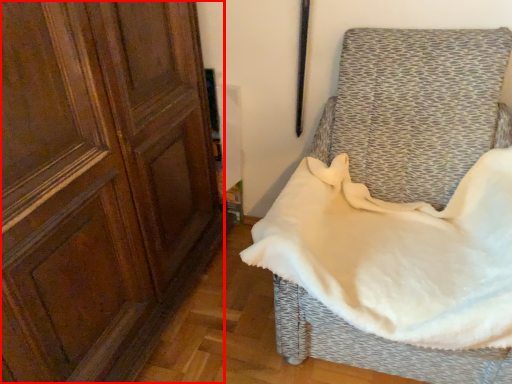
Question: From the image's perspective, where is screen door (annotated by the red box) located relative to furniture?

Choices:
 (A) above
 (B) below

Answer: (A)